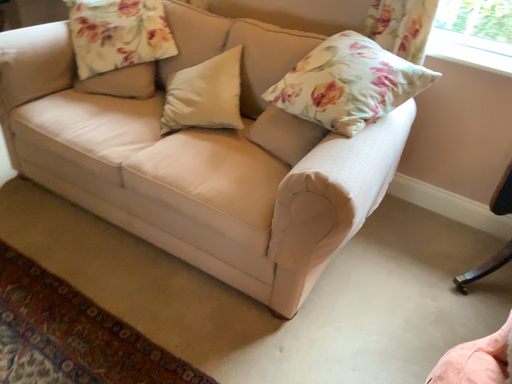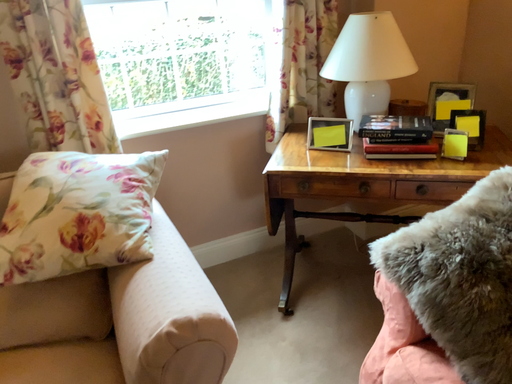
Question: How did the camera likely rotate when shooting the video?

Choices:
 (A) rotated right
 (B) rotated left

Answer: (A)